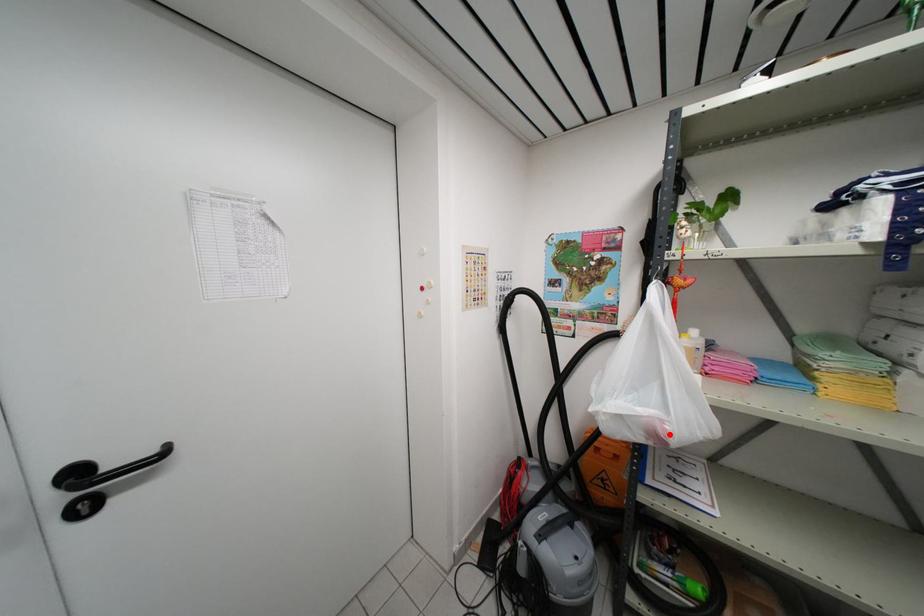
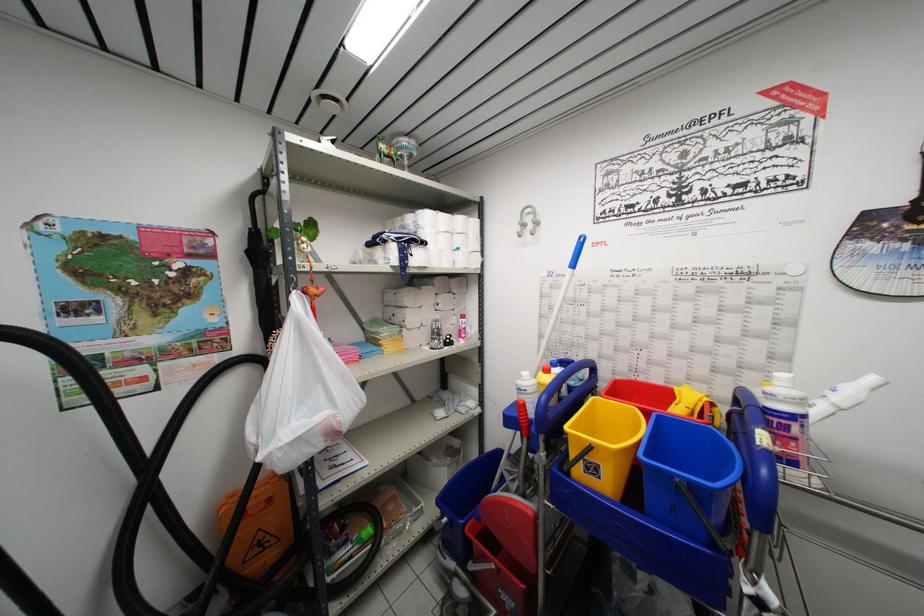
The point at the highlighted location is marked in the first image. Where is the corresponding point in the second image?

(342, 427)